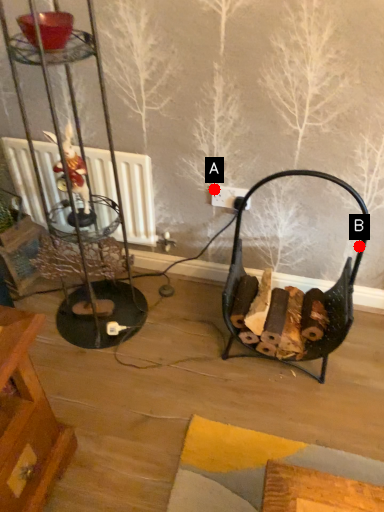
Question: Two points are circled on the image, labeled by A and B beside each circle. Among these points, which one is farthest from the camera?

Choices:
 (A) A is further
 (B) B is further

Answer: (A)